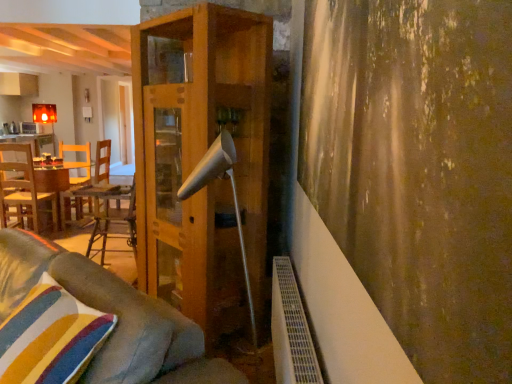
Question: From a real-world perspective, is white matte lamp at center on top of wooden table at left, arranged as the 2th table when viewed from the front?

Choices:
 (A) no
 (B) yes

Answer: (B)

Question: From the image's perspective, is white matte lamp at center beneath wooden table at left, which is the first table from left to right?

Choices:
 (A) yes
 (B) no

Answer: (A)

Question: Does white matte lamp at center have a lesser width compared to wooden table at left, marked as the 2th table in a bottom-to-top arrangement?

Choices:
 (A) yes
 (B) no

Answer: (A)

Question: Can you confirm if white matte lamp at center is positioned to the left of wooden table at left, acting as the 1th table starting from the top?

Choices:
 (A) no
 (B) yes

Answer: (A)

Question: Considering the relative sizes of white matte lamp at center and wooden table at left, acting as the 1th table starting from the top, in the image provided, is white matte lamp at center smaller than wooden table at left, acting as the 1th table starting from the top,?

Choices:
 (A) yes
 (B) no

Answer: (A)

Question: Does point (262, 150) appear closer or farther from the camera than point (232, 201)?

Choices:
 (A) closer
 (B) farther

Answer: (A)

Question: From a real-world perspective, is wooden shelf at center positioned above or below white matte lamp at center?

Choices:
 (A) above
 (B) below

Answer: (A)

Question: In the image, is wooden shelf at center on the left side or the right side of white matte lamp at center?

Choices:
 (A) right
 (B) left

Answer: (B)

Question: Looking at their shapes, would you say wooden shelf at center is wider or thinner than white matte lamp at center?

Choices:
 (A) thin
 (B) wide

Answer: (B)

Question: From the image's perspective, is woodenmaterial/texturetable at left, positioned as the 1th table in right-to-left order, positioned above or below striped fabric pillow at lower left?

Choices:
 (A) below
 (B) above

Answer: (B)

Question: Visually, is woodenmaterial/texturetable at left, the second table in the top-to-bottom sequence, positioned to the left or to the right of striped fabric pillow at lower left?

Choices:
 (A) left
 (B) right

Answer: (A)

Question: Considering their positions, is woodenmaterial/texturetable at left, the first table in the front-to-back sequence, located in front of or behind striped fabric pillow at lower left?

Choices:
 (A) front
 (B) behind

Answer: (B)

Question: In terms of size, does woodenmaterial/texturetable at left, placed as the second table when sorted from back to front, appear bigger or smaller than striped fabric pillow at lower left?

Choices:
 (A) small
 (B) big

Answer: (B)

Question: Based on their positions, is woodenmaterial/texturetable at left, placed as the second table when sorted from back to front, located to the left or right of velvet gray couch at lower left?

Choices:
 (A) right
 (B) left

Answer: (B)

Question: Is woodenmaterial/texturetable at left, positioned as the 1th table in right-to-left order, in front of or behind velvet gray couch at lower left in the image?

Choices:
 (A) front
 (B) behind

Answer: (B)